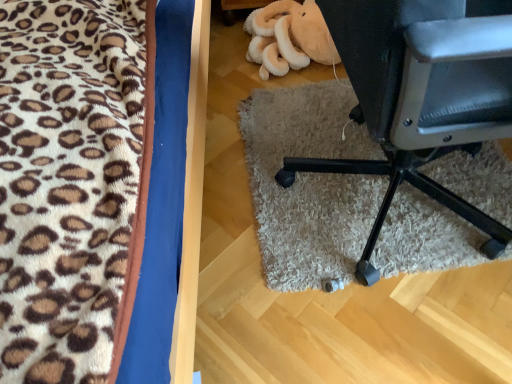
The image size is (512, 384). What do you see at coordinates (91, 187) in the screenshot?
I see `fluffy leopard print blanket at left` at bounding box center [91, 187].

Where is `soft plush toy at upper center`? This screenshot has height=384, width=512. soft plush toy at upper center is located at coordinates (289, 38).

Considering the points (26, 109) and (289, 12), which point is behind, point (26, 109) or point (289, 12)?

Positioned behind is point (289, 12).

In the image, there is a fluffy leopard print blanket at left. Where is `stuff below it (from a real-world perspective)`? stuff below it (from a real-world perspective) is located at coordinates (289, 38).

From a real-world perspective, relative to soft plush toy at upper center, is fluffy leopard print blanket at left vertically above or below?

fluffy leopard print blanket at left is situated higher than soft plush toy at upper center in the real world.

Considering the relative sizes of fluffy leopard print blanket at left and soft plush toy at upper center in the image provided, is fluffy leopard print blanket at left shorter than soft plush toy at upper center?

Incorrect, the height of fluffy leopard print blanket at left does not fall short of that of soft plush toy at upper center.

Looking at this image, which is more to the left, black leather chair at lower right or soft plush toy at upper center?

soft plush toy at upper center is more to the left.

Locate an element on the screen. This screenshot has width=512, height=384. stuff above the black leather chair at lower right (from the image's perspective) is located at coordinates [289, 38].

How many degrees apart are the facing directions of black leather chair at lower right and soft plush toy at upper center?

black leather chair at lower right and soft plush toy at upper center are facing 173 degrees away from each other.

Consider the image. From the image's perspective, who appears lower, black leather chair at lower right or soft plush toy at upper center?

From the image's view, black leather chair at lower right is below.

Is black leather chair at lower right facing away from fluffy leopard print blanket at left?

Yes, black leather chair at lower right is positioned with its back facing fluffy leopard print blanket at left.

Is black leather chair at lower right not near fluffy leopard print blanket at left?

Actually, black leather chair at lower right and fluffy leopard print blanket at left are a little close together.

Based on the photo, which is nearer, (498,51) or (50,344)?

Point (498,51) is farther from the camera than point (50,344).

From the image's perspective, which is above, soft plush toy at upper center or fluffy leopard print blanket at left?

soft plush toy at upper center appears higher in the image.

How different are the orientations of soft plush toy at upper center and fluffy leopard print blanket at left in degrees?

They differ by 95.5 degrees in their facing directions.

Is soft plush toy at upper center in front of fluffy leopard print blanket at left?

No, it is behind fluffy leopard print blanket at left.

Is soft plush toy at upper center closer to the viewer compared to black leather chair at lower right?

No, it is not.

How many degrees apart are the facing directions of soft plush toy at upper center and black leather chair at lower right?

The angle between the facing direction of soft plush toy at upper center and the facing direction of black leather chair at lower right is 173 degrees.

Locate an element on the screen. chair located in front of the soft plush toy at upper center is located at coordinates (422, 95).

From the picture: Which object is positioned more to the right, soft plush toy at upper center or black leather chair at lower right?

black leather chair at lower right is more to the right.

Between fluffy leopard print blanket at left and black leather chair at lower right, which one has smaller width?

Thinner between the two is black leather chair at lower right.

Considering their positions, is fluffy leopard print blanket at left located in front of or behind black leather chair at lower right?

Clearly, fluffy leopard print blanket at left is in front of black leather chair at lower right.

From a real-world perspective, is fluffy leopard print blanket at left positioned above or below black leather chair at lower right?

In terms of real-world spatial position, fluffy leopard print blanket at left is above black leather chair at lower right.

Considering the relative positions of fluffy leopard print blanket at left and black leather chair at lower right in the image provided, is fluffy leopard print blanket at left to the left of black leather chair at lower right from the viewer's perspective?

Yes.

There is a soft plush toy at upper center. Where is `furniture above it (from a real-world perspective)`? furniture above it (from a real-world perspective) is located at coordinates click(91, 187).

Locate an element on the screen. stuff lying behind the black leather chair at lower right is located at coordinates (289, 38).

When comparing their distances from black leather chair at lower right, does fluffy leopard print blanket at left or soft plush toy at upper center seem further?

The object further to black leather chair at lower right is soft plush toy at upper center.

When comparing their distances from black leather chair at lower right, does soft plush toy at upper center or fluffy leopard print blanket at left seem closer?

fluffy leopard print blanket at left lies closer to black leather chair at lower right than the other object.

Which object lies nearer to the anchor point soft plush toy at upper center, black leather chair at lower right or fluffy leopard print blanket at left?

black leather chair at lower right is closer to soft plush toy at upper center.

Based on their spatial positions, is fluffy leopard print blanket at left or black leather chair at lower right further from soft plush toy at upper center?

Among the two, fluffy leopard print blanket at left is located further to soft plush toy at upper center.

Considering their positions, is soft plush toy at upper center positioned further to fluffy leopard print blanket at left than black leather chair at lower right?

Based on the image, soft plush toy at upper center appears to be further to fluffy leopard print blanket at left.

Based on their spatial positions, is black leather chair at lower right or soft plush toy at upper center further from fluffy leopard print blanket at left?

soft plush toy at upper center is positioned further to the anchor fluffy leopard print blanket at left.

Locate an element on the screen. chair located between fluffy leopard print blanket at left and soft plush toy at upper center in the depth direction is located at coordinates (422, 95).